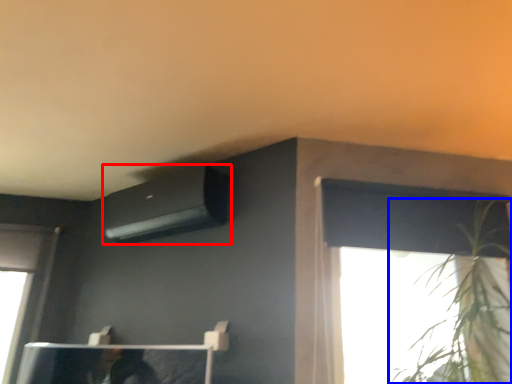
Question: Which object is closer to the camera taking this photo, air conditioning (highlighted by a red box) or houseplant (highlighted by a blue box)?

Choices:
 (A) air conditioning
 (B) houseplant

Answer: (B)